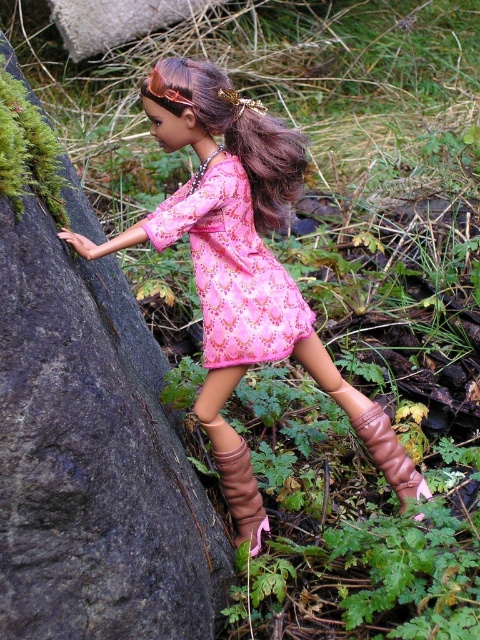
Question: Among these points, which one is nearest to the camera?

Choices:
 (A) (148, 81)
 (B) (223, 189)

Answer: (A)

Question: Does pink satin dress at center lie behind brown leather boot at center?

Choices:
 (A) yes
 (B) no

Answer: (B)

Question: In this image, where is smooth gray rock at left located relative to pink fabric dress at center?

Choices:
 (A) right
 (B) left

Answer: (B)

Question: Does smooth gray rock at left lie in front of pink fabric dress at center?

Choices:
 (A) yes
 (B) no

Answer: (A)

Question: Which object appears closest to the camera in this image?

Choices:
 (A) pink fabric dress at center
 (B) pink satin dress at center

Answer: (B)

Question: Based on their relative distances, which object is farther from the brown shiny hair at center?

Choices:
 (A) leather-like brown boot at lower center
 (B) pink satin dress at center
 (C) brown leather boot at center

Answer: (C)